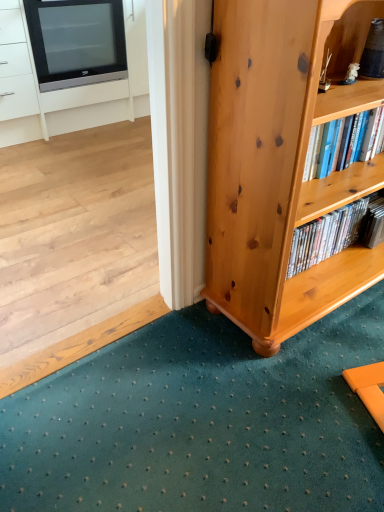
Question: Is light brown wood bookcase at lower right bigger than black glossy television at upper left?

Choices:
 (A) yes
 (B) no

Answer: (A)

Question: Is light brown wood bookcase at lower right to the left of black glossy television at upper left from the viewer's perspective?

Choices:
 (A) yes
 (B) no

Answer: (B)

Question: Is light brown wood bookcase at lower right smaller than black glossy television at upper left?

Choices:
 (A) yes
 (B) no

Answer: (B)

Question: Is light brown wood bookcase at lower right thinner than black glossy television at upper left?

Choices:
 (A) no
 (B) yes

Answer: (B)

Question: Is light brown wood bookcase at lower right positioned in front of black glossy television at upper left?

Choices:
 (A) yes
 (B) no

Answer: (A)

Question: Is light brown wood bookcase at lower right at the right side of black glossy television at upper left?

Choices:
 (A) yes
 (B) no

Answer: (A)

Question: Is black glossy television at upper left to the left of light brown wood bookcase at lower right from the viewer's perspective?

Choices:
 (A) yes
 (B) no

Answer: (A)

Question: Is light brown wood bookcase at lower right at the back of black glossy television at upper left?

Choices:
 (A) no
 (B) yes

Answer: (A)

Question: Is black glossy television at upper left outside light brown wood bookcase at lower right?

Choices:
 (A) yes
 (B) no

Answer: (A)

Question: Considering the relative sizes of black glossy television at upper left and light brown wood bookcase at lower right in the image provided, is black glossy television at upper left bigger than light brown wood bookcase at lower right?

Choices:
 (A) no
 (B) yes

Answer: (A)

Question: From a real-world perspective, is black glossy television at upper left on light brown wood bookcase at lower right?

Choices:
 (A) no
 (B) yes

Answer: (B)

Question: Does black glossy television at upper left have a greater width compared to light brown wood bookcase at lower right?

Choices:
 (A) no
 (B) yes

Answer: (B)

Question: Considering the relative positions of matte black tv at upper left and black glossy television at upper left in the image provided, is matte black tv at upper left to the left of black glossy television at upper left from the viewer's perspective?

Choices:
 (A) no
 (B) yes

Answer: (B)